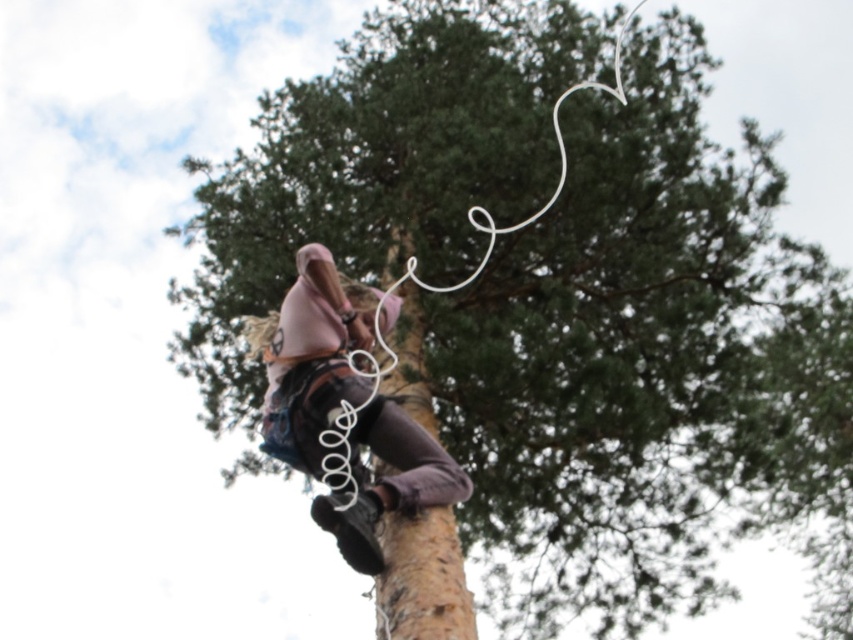
Between pink fabric at center and brown rough tree trunk at center, which one appears on the right side from the viewer's perspective?

brown rough tree trunk at center is more to the right.

Between pink fabric at center and brown rough tree trunk at center, which one has more height?

pink fabric at center

What do you see at coordinates (312, 358) in the screenshot?
I see `pink fabric at center` at bounding box center [312, 358].

You are a GUI agent. You are given a task and a screenshot of the screen. Output one action in this format:
    pyautogui.click(x=<x>, y=<y>)
    Task: Click on the pink fabric at center
    
    Given the screenshot: What is the action you would take?
    pyautogui.click(x=312, y=358)